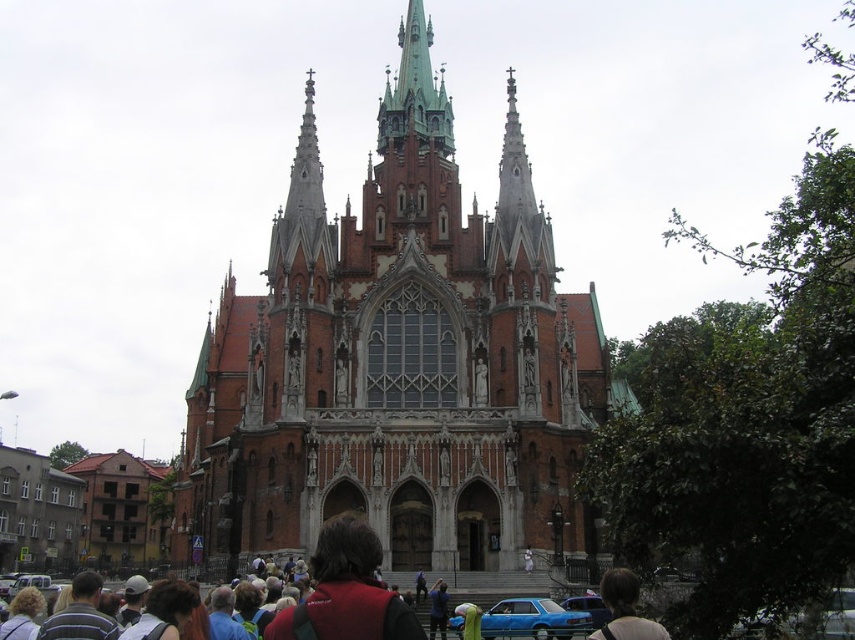
Question: Observing the image, what is the correct spatial positioning of blue matte car at lower center in reference to dark brown hair at center?

Choices:
 (A) above
 (B) below

Answer: (B)

Question: Which object is farther from the camera taking this photo?

Choices:
 (A) dark brown leather backpack at center
 (B) red brick church at center
 (C) blue matte car at lower center

Answer: (B)

Question: Is red brick church at center smaller than blue matte car at lower center?

Choices:
 (A) yes
 (B) no

Answer: (B)

Question: Among these points, which one is farthest from the camera?

Choices:
 (A) (458, 550)
 (B) (611, 636)

Answer: (A)

Question: Which object is positioned closest to the dark brown leather backpack at center?

Choices:
 (A) blue matte car at lower center
 (B) dark brown hair at center
 (C) red brick church at center

Answer: (B)

Question: Does red brick church at center have a larger size compared to blue matte car at lower center?

Choices:
 (A) no
 (B) yes

Answer: (B)